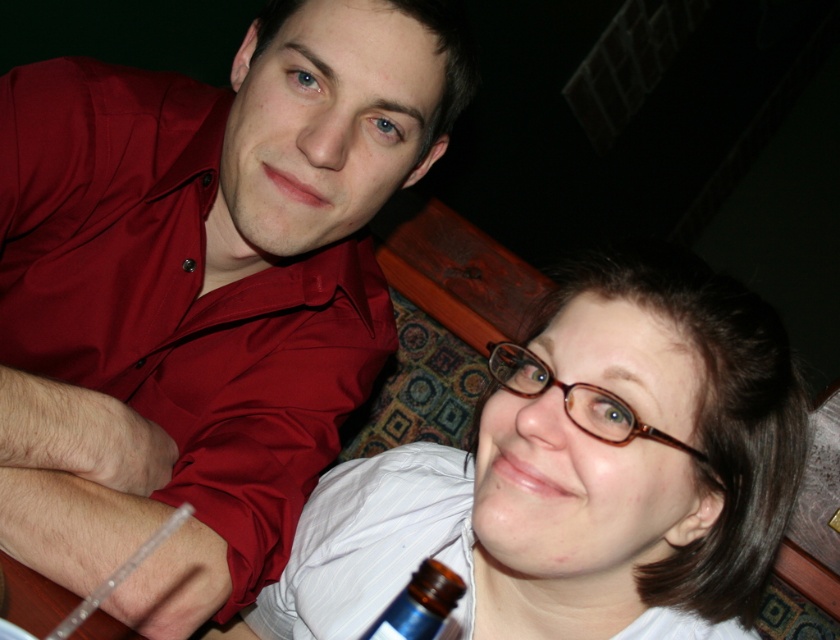
Does shiny red shirt at upper left have a greater height compared to matte white shirt at lower center?

Yes.

Who is higher up, shiny red shirt at upper left or matte white shirt at lower center?

shiny red shirt at upper left is above.

Between point (336, 134) and point (756, 316), which one is positioned behind?

Positioned behind is point (336, 134).

The image size is (840, 640). What are the coordinates of `shiny red shirt at upper left` in the screenshot? It's located at (235, 289).

Measure the distance between shiny red shirt at upper left and brown glass bottle at lower center.

The distance of shiny red shirt at upper left from brown glass bottle at lower center is 14.85 inches.

Looking at this image, can you confirm if shiny red shirt at upper left is smaller than brown glass bottle at lower center?

Actually, shiny red shirt at upper left might be larger than brown glass bottle at lower center.

Is point (80, 186) behind point (413, 634)?

Yes, point (80, 186) is behind point (413, 634).

Where is `shiny red shirt at upper left`? The width and height of the screenshot is (840, 640). shiny red shirt at upper left is located at coordinates (235, 289).

Is point (368, 529) more distant than point (442, 566)?

That is True.

Which is in front, point (518, 483) or point (442, 586)?

Point (442, 586) is in front.

Which is behind, point (517, 568) or point (426, 596)?

The point (517, 568) is more distant.

In order to click on matte white shirt at lower center in this screenshot , I will do `click(579, 474)`.